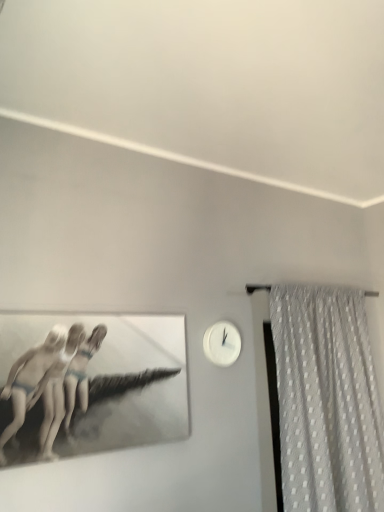
Question: Is white dotted fabric at right bigger or smaller than white glossy clock at upper right?

Choices:
 (A) small
 (B) big

Answer: (B)

Question: Is white dotted fabric at right wider or thinner than white glossy clock at upper right?

Choices:
 (A) wide
 (B) thin

Answer: (A)

Question: From a real-world perspective, relative to white glossy clock at upper right, is white dotted fabric at right vertically above or below?

Choices:
 (A) above
 (B) below

Answer: (B)

Question: Visually, is white glossy clock at upper right positioned to the left or to the right of white dotted fabric at right?

Choices:
 (A) left
 (B) right

Answer: (A)

Question: In terms of height, does white glossy clock at upper right look taller or shorter compared to white dotted fabric at right?

Choices:
 (A) tall
 (B) short

Answer: (B)

Question: Considering their positions, is white glossy clock at upper right located in front of or behind white dotted fabric at right?

Choices:
 (A) front
 (B) behind

Answer: (B)

Question: Is white glossy clock at upper right inside or outside of white dotted fabric at right?

Choices:
 (A) inside
 (B) outside

Answer: (B)